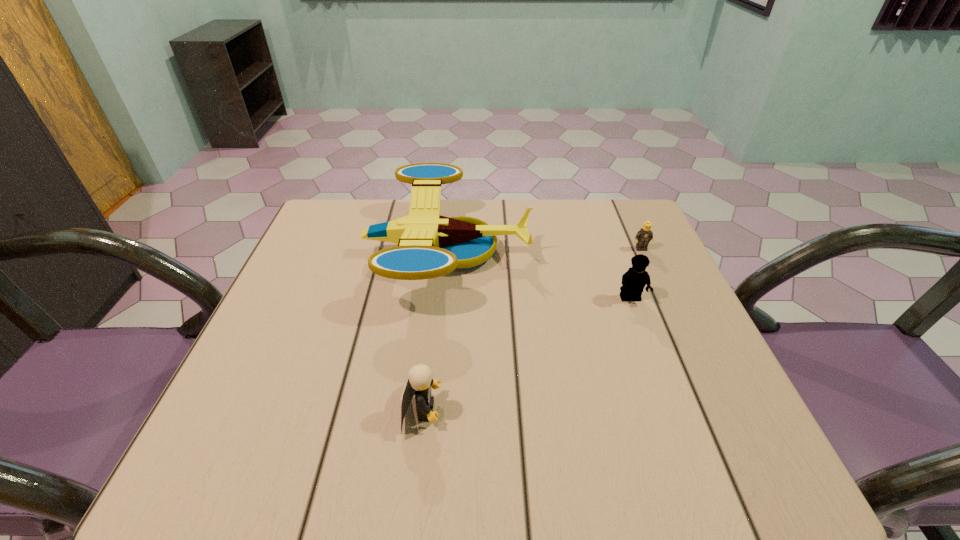
I want to click on drone, so click(x=430, y=245).

This screenshot has width=960, height=540. Identify the location of the second farthest Lego. (636, 278).

Locate an element on the screen. This screenshot has height=540, width=960. the second Lego from left to right is located at coordinates (636, 278).

This screenshot has width=960, height=540. In order to click on the nearest object in this screenshot , I will do `click(420, 381)`.

Where is `the nearest Lego`? Image resolution: width=960 pixels, height=540 pixels. the nearest Lego is located at coordinates (420, 381).

Where is `the rightmost object`? the rightmost object is located at coordinates (644, 235).

This screenshot has width=960, height=540. I want to click on the farthest Lego, so click(644, 235).

Where is `free space located 0.130m at the cockpit of the drone`? The image size is (960, 540). free space located 0.130m at the cockpit of the drone is located at coordinates (581, 253).

You are a GUI agent. You are given a task and a screenshot of the screen. Output one action in this format:
    pyautogui.click(x=<x>, y=<y>)
    Task: Click on the free region located 0.290m on the front-facing side of the second farthest Lego
    This screenshot has height=540, width=960.
    Given the screenshot: What is the action you would take?
    pyautogui.click(x=677, y=426)

This screenshot has height=540, width=960. Find the location of `free location located on the front-facing side of the nearest Lego`. free location located on the front-facing side of the nearest Lego is located at coordinates (600, 410).